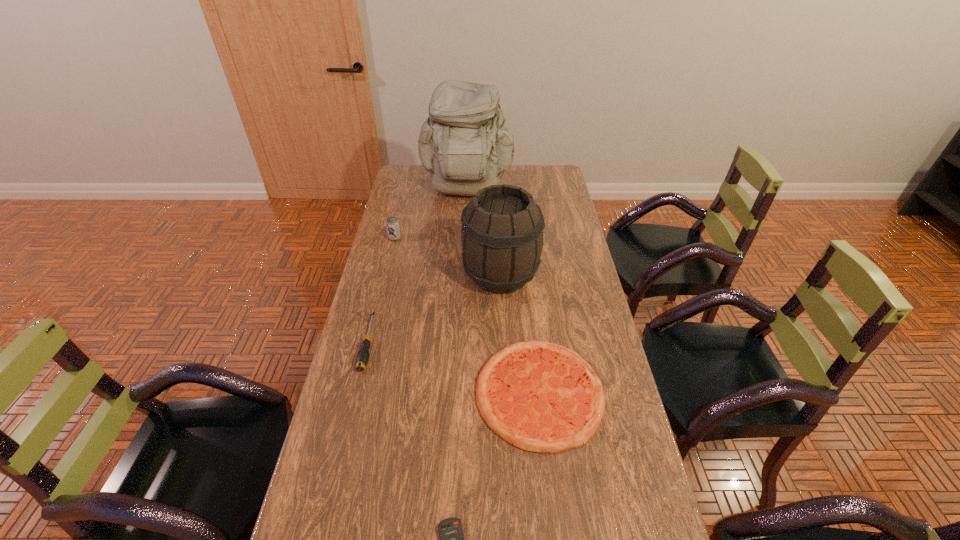
Locate which object is the fourth closest to the pizza. Please provide its 2D coordinates. Your answer should be formatted as a tuple, i.e. [(x, y)], where the tuple contains the x and y coordinates of a point satisfying the conditions above.

[(392, 224)]

I want to click on object that is the fifth closest to the fourth nearest object, so click(451, 535).

Identify the location of vacant area that satisfies the following two spatial constraints: 1. on the back side of the wine bucket; 2. on the right side of the screwdriver. The width and height of the screenshot is (960, 540). (384, 276).

The image size is (960, 540). I want to click on free spot that satisfies the following two spatial constraints: 1. on the back side of the fourth nearest object; 2. on the right side of the screwdriver, so click(x=384, y=276).

Identify the location of free region that satisfies the following two spatial constraints: 1. on the front-facing side of the fifth shortest object; 2. on the right side of the tallest object. The height and width of the screenshot is (540, 960). (464, 276).